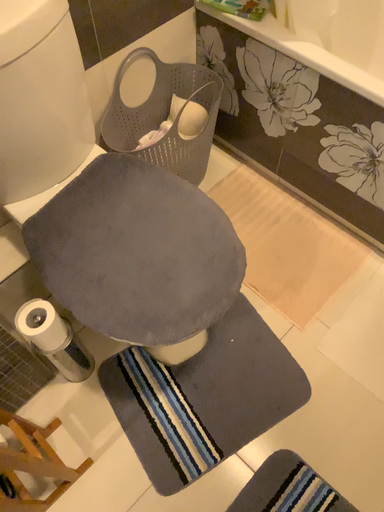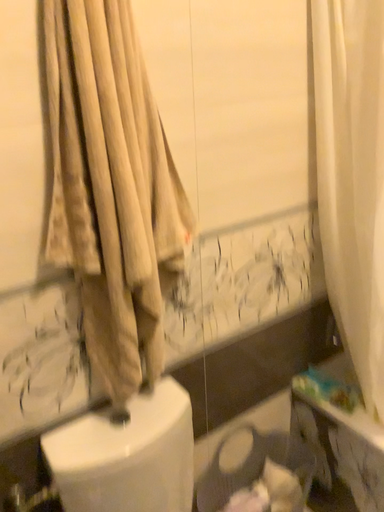
Question: How did the camera likely rotate when shooting the video?

Choices:
 (A) rotated upward
 (B) rotated downward

Answer: (A)